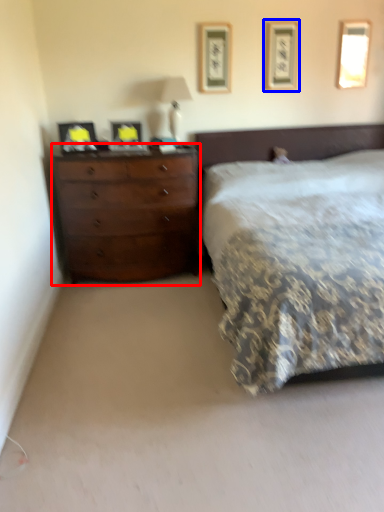
Question: Among these objects, which one is farthest to the camera, chest of drawers (highlighted by a red box) or picture frame (highlighted by a blue box)?

Choices:
 (A) chest of drawers
 (B) picture frame

Answer: (B)